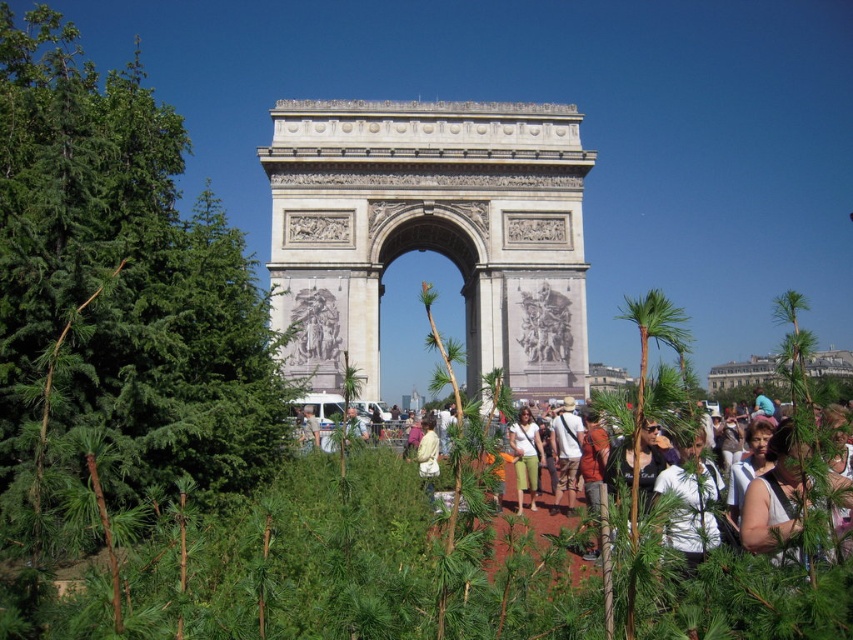
You are a tourist standing at the base of the Arc de Triomphe and notice two people wearing shirts of different colors. The first person is wearing a matte white shirt at center, and the second is wearing a matte orange shirt at center. Which shirt is positioned higher relative to the other?

The matte white shirt at center is above the matte orange shirt at center, so the white shirt is positioned higher than the orange one.

You are a photographer planning to capture a candid shot of two people dressed in khaki cotton shorts at center and matte orange shirt at center. Since you want to ensure both subjects are clearly visible in the frame, which clothing item should you focus on to ensure it doesn not get cropped out?

The matte orange shirt at center occupies more space than the khaki cotton shorts at center, so you should focus on ensuring the matte orange shirt at center is fully within the frame to avoid cropping.